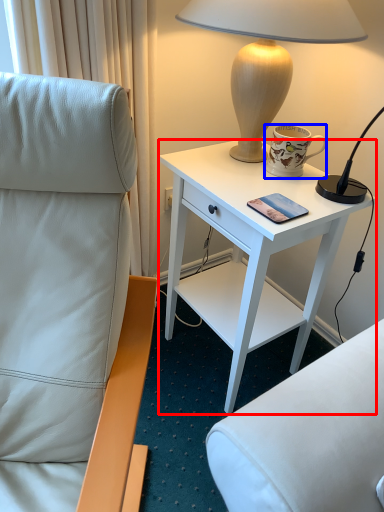
Question: Which object is further to the camera taking this photo, desk (highlighted by a red box) or coffee cup (highlighted by a blue box)?

Choices:
 (A) desk
 (B) coffee cup

Answer: (B)